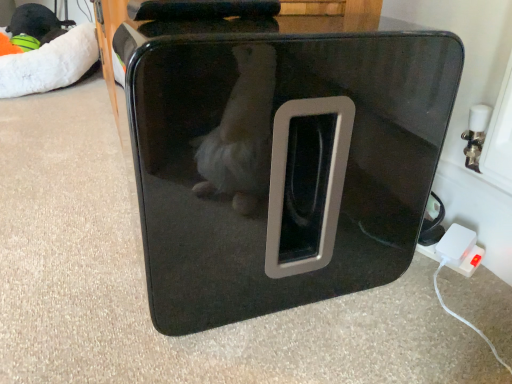
Question: Can you confirm if white plastic power adapter at lower right is bigger than white plush bean bag at upper left?

Choices:
 (A) yes
 (B) no

Answer: (B)

Question: Is white plastic power adapter at lower right taller than white plush bean bag at upper left?

Choices:
 (A) no
 (B) yes

Answer: (A)

Question: Is white plastic power adapter at lower right to the left of white plush bean bag at upper left from the viewer's perspective?

Choices:
 (A) no
 (B) yes

Answer: (A)

Question: Is the depth of white plastic power adapter at lower right greater than that of white plush bean bag at upper left?

Choices:
 (A) no
 (B) yes

Answer: (A)

Question: Is white plastic power adapter at lower right oriented away from white plush bean bag at upper left?

Choices:
 (A) yes
 (B) no

Answer: (B)

Question: Is glossy black pet carrier at center in front of or behind white plastic power adapter at lower right in the image?

Choices:
 (A) behind
 (B) front

Answer: (B)

Question: Is glossy black pet carrier at center taller or shorter than white plastic power adapter at lower right?

Choices:
 (A) tall
 (B) short

Answer: (A)

Question: Is glossy black pet carrier at center spatially inside white plastic power adapter at lower right, or outside of it?

Choices:
 (A) inside
 (B) outside

Answer: (B)

Question: From a real-world perspective, is glossy black pet carrier at center positioned above or below white plastic power adapter at lower right?

Choices:
 (A) above
 (B) below

Answer: (A)

Question: Which is correct: white plastic power adapter at lower right is inside glossy black pet carrier at center, or outside of it?

Choices:
 (A) inside
 (B) outside

Answer: (B)

Question: Is point pos(439,241) closer or farther from the camera than point pos(303,241)?

Choices:
 (A) closer
 (B) farther

Answer: (B)

Question: From their relative heights in the image, would you say white plastic power adapter at lower right is taller or shorter than glossy black pet carrier at center?

Choices:
 (A) short
 (B) tall

Answer: (A)

Question: Is white plastic power adapter at lower right wider or thinner than glossy black pet carrier at center?

Choices:
 (A) wide
 (B) thin

Answer: (B)

Question: From a real-world perspective, relative to white plastic power adapter at lower right, is white plush bean bag at upper left vertically above or below?

Choices:
 (A) above
 (B) below

Answer: (A)

Question: Is white plush bean bag at upper left in front of or behind white plastic power adapter at lower right in the image?

Choices:
 (A) front
 (B) behind

Answer: (B)